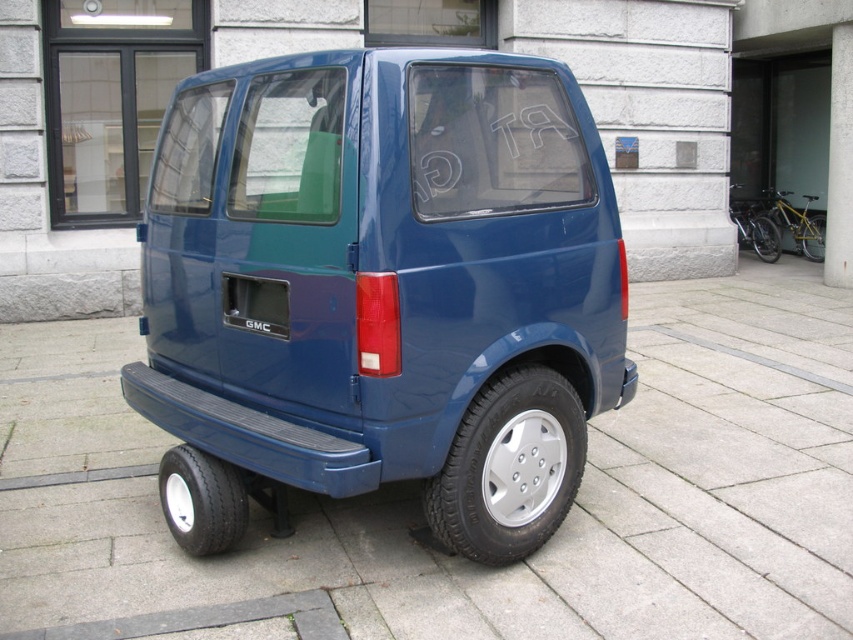
Question: Which is farther from the black rubber wheel at center?

Choices:
 (A) black rubber wheel at lower right
 (B) smooth concrete pavement at center
 (C) black rubber tire at lower left

Answer: (C)

Question: Does glossy blue van at center come behind matte blue bumper at rear?

Choices:
 (A) no
 (B) yes

Answer: (A)

Question: Is glossy blue van at center to the left of rubber/textured bumper at rear from the viewer's perspective?

Choices:
 (A) no
 (B) yes

Answer: (A)

Question: Can you confirm if glossy blue van at center is positioned below silver metallic wheel at lower right?

Choices:
 (A) yes
 (B) no

Answer: (B)

Question: Considering the real-world distances, which object is closest to the smooth concrete pavement at center?

Choices:
 (A) yellow matte bicycle at right
 (B) silver metallic wheel at lower right
 (C) black rubber wheel at lower right
 (D) matte blue bumper at rear

Answer: (B)

Question: Which point is farther to the camera?

Choices:
 (A) rubber/textured bumper at rear
 (B) black rubber wheel at center
 (C) silver metallic wheel at lower right
 (D) matte blue bumper at rear

Answer: (B)